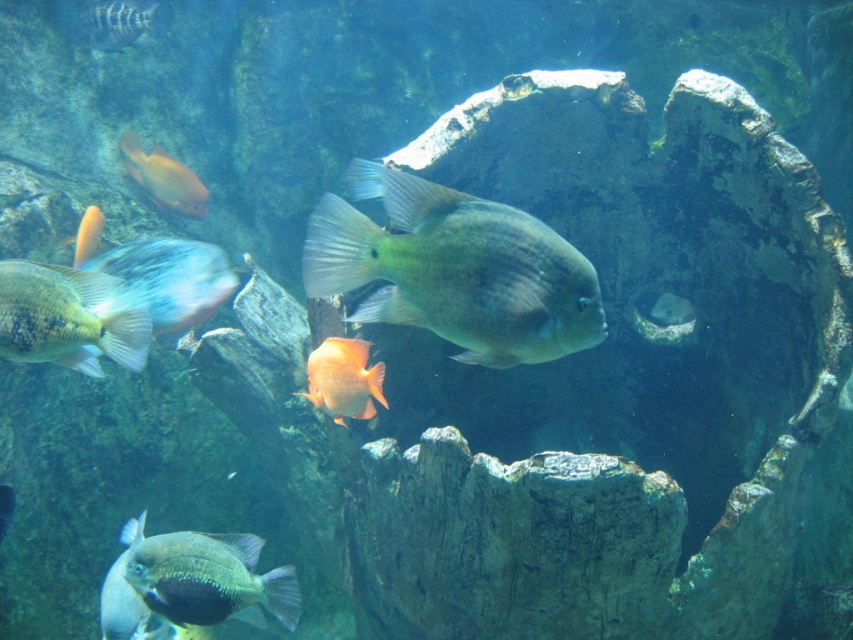
This screenshot has width=853, height=640. Describe the element at coordinates (67, 317) in the screenshot. I see `speckled blue fish at left` at that location.

Does point (86, 305) lie behind point (364, 365)?

No, (86, 305) is closer to viewer.

You are a GUI agent. You are given a task and a screenshot of the screen. Output one action in this format:
    pyautogui.click(x=<x>, y=<y>)
    Task: Click on the speckled blue fish at left
    
    Given the screenshot: What is the action you would take?
    pyautogui.click(x=67, y=317)

Does shiny blue fish at lower left lie in front of orange matte fish at left?

That is True.

Does shiny blue fish at lower left appear under orange matte fish at left?

Correct, shiny blue fish at lower left is located below orange matte fish at left.

Between point (283, 618) and point (86, 227), which one is positioned behind?

The point (86, 227) is behind.

Where is `shiny blue fish at lower left`? The height and width of the screenshot is (640, 853). shiny blue fish at lower left is located at coordinates (210, 579).

Between point (221, 285) and point (149, 20), which one is positioned behind?

Positioned behind is point (149, 20).

Can you confirm if shiny blue fish at center is taller than shiny silver fish at upper left?

Correct, shiny blue fish at center is much taller as shiny silver fish at upper left.

Image resolution: width=853 pixels, height=640 pixels. Find the location of `shiny blue fish at center`. shiny blue fish at center is located at coordinates (167, 278).